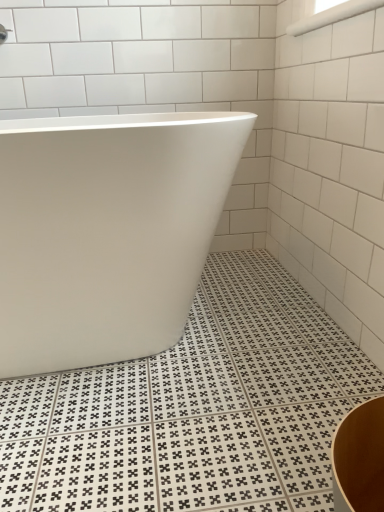
Question: Can we say white glossy grab bar at upper right lies outside white glossy bathtub at center?

Choices:
 (A) yes
 (B) no

Answer: (A)

Question: Is white glossy grab bar at upper right placed right next to white glossy bathtub at center?

Choices:
 (A) yes
 (B) no

Answer: (B)

Question: Is white glossy grab bar at upper right closer to the viewer compared to white glossy bathtub at center?

Choices:
 (A) yes
 (B) no

Answer: (B)

Question: Could you tell me if white glossy grab bar at upper right is turned towards white glossy bathtub at center?

Choices:
 (A) yes
 (B) no

Answer: (B)

Question: Considering the relative sizes of white glossy grab bar at upper right and white glossy bathtub at center in the image provided, is white glossy grab bar at upper right taller than white glossy bathtub at center?

Choices:
 (A) no
 (B) yes

Answer: (A)

Question: Is white glossy bathtub at center located within white glossy grab bar at upper right?

Choices:
 (A) no
 (B) yes

Answer: (A)

Question: Is white glossy bathtub at center aimed at white glossy grab bar at upper right?

Choices:
 (A) yes
 (B) no

Answer: (B)

Question: Is white glossy bathtub at center positioned with its back to white glossy grab bar at upper right?

Choices:
 (A) yes
 (B) no

Answer: (B)

Question: Is white glossy bathtub at center at the right side of white glossy grab bar at upper right?

Choices:
 (A) yes
 (B) no

Answer: (B)

Question: Is white glossy bathtub at center further to the viewer compared to white glossy grab bar at upper right?

Choices:
 (A) yes
 (B) no

Answer: (B)

Question: Considering the relative sizes of white glossy bathtub at center and white glossy grab bar at upper right in the image provided, is white glossy bathtub at center shorter than white glossy grab bar at upper right?

Choices:
 (A) yes
 (B) no

Answer: (B)

Question: Is white glossy bathtub at center wider than white glossy grab bar at upper right?

Choices:
 (A) no
 (B) yes

Answer: (B)

Question: Is white glossy grab bar at upper right situated inside white glossy bathtub at center or outside?

Choices:
 (A) inside
 (B) outside

Answer: (B)